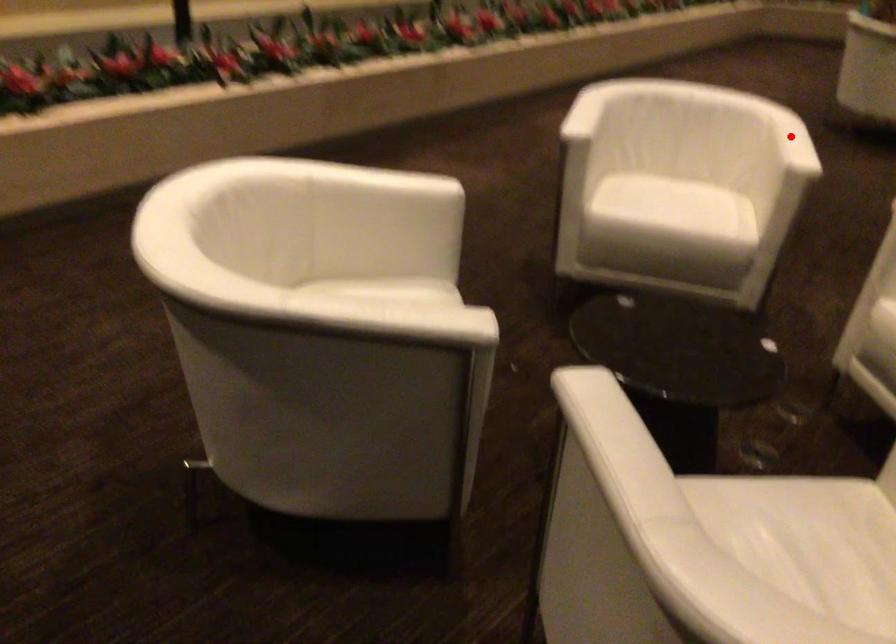
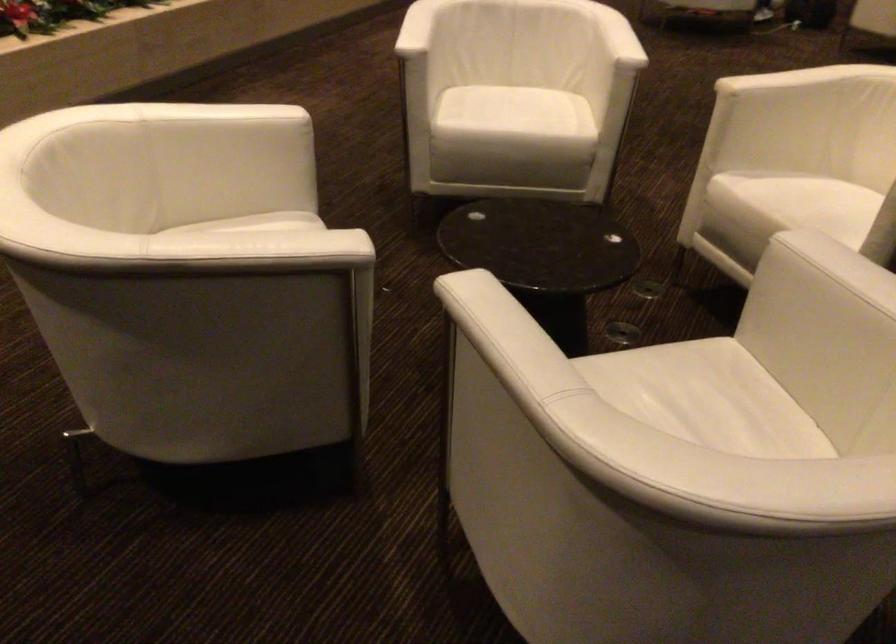
The point at the highlighted location is marked in the first image. Where is the corresponding point in the second image?

(617, 37)